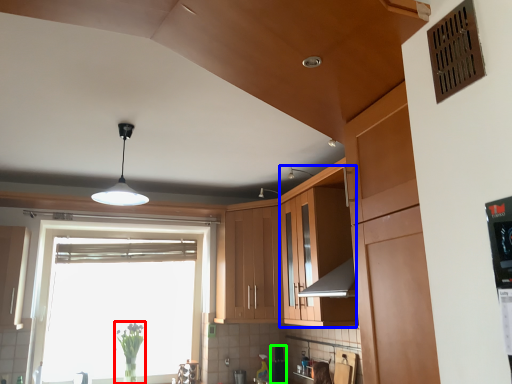
Question: Which object is positioned closest to plant (highlighted by a red box)? Select from cabinetry (highlighted by a blue box) and appliance (highlighted by a green box).

Choices:
 (A) cabinetry
 (B) appliance

Answer: (B)